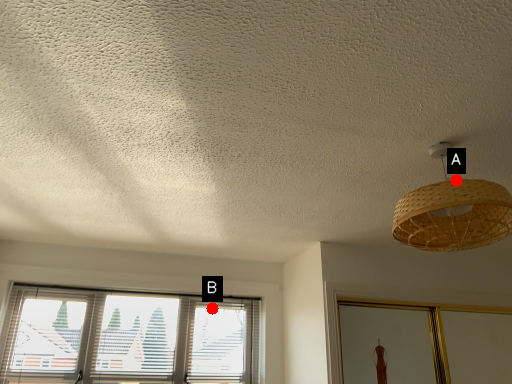
Question: Two points are circled on the image, labeled by A and B beside each circle. Which point is closer to the camera taking this photo?

Choices:
 (A) A is closer
 (B) B is closer

Answer: (A)